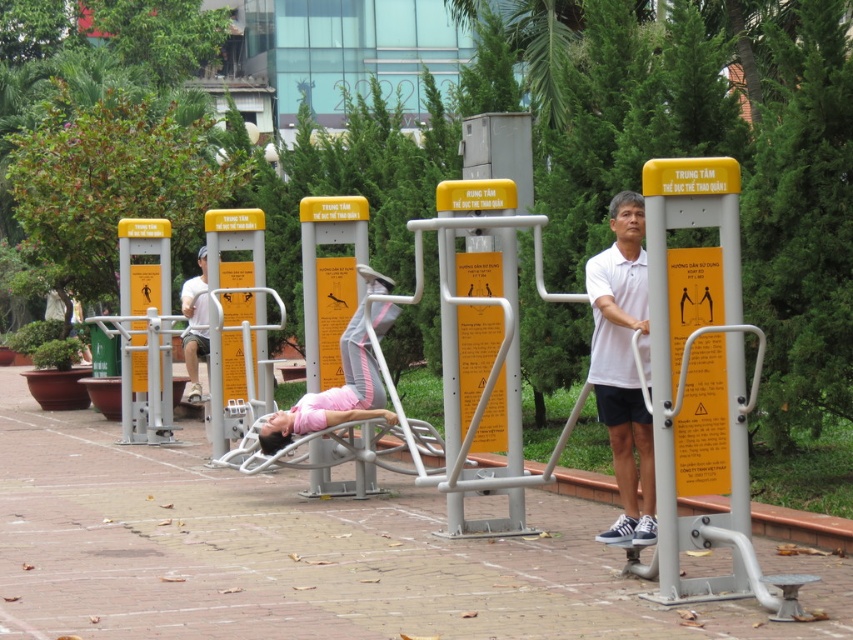
Between matte yellow pole at center and matte white shirt at center, which one appears on the left side from the viewer's perspective?

From the viewer's perspective, matte white shirt at center appears more on the left side.

Can you confirm if matte yellow pole at center is taller than matte white shirt at center?

Correct, matte yellow pole at center is much taller as matte white shirt at center.

Is point (219, 308) more distant than point (184, 282)?

No.

The height and width of the screenshot is (640, 853). What are the coordinates of `matte yellow pole at center` in the screenshot? It's located at (215, 349).

Does white matte shirt at center have a greater height compared to matte yellow pole at center?

No.

Based on the photo, does white matte shirt at center lie in front of matte yellow pole at center?

Yes, white matte shirt at center is closer to the viewer.

Measure the distance between point (630, 312) and camera.

A distance of 33.34 feet exists between point (630, 312) and camera.

Identify the location of white matte shirt at center. pos(624,364).

Based on the photo, is white matte shirt at center to the right of matte white shirt at center from the viewer's perspective?

Indeed, white matte shirt at center is positioned on the right side of matte white shirt at center.

What do you see at coordinates (624, 364) in the screenshot? I see `white matte shirt at center` at bounding box center [624, 364].

What do you see at coordinates (624, 364) in the screenshot? I see `white matte shirt at center` at bounding box center [624, 364].

This screenshot has width=853, height=640. I want to click on white matte shirt at center, so pos(624,364).